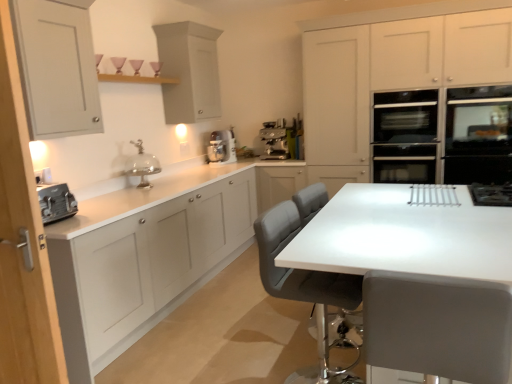
Question: Is gray leather chair at center, marked as the 1th chair in a back-to-front arrangement, wider than matte white toaster at left, which is the second cabinetry in left-to-right order?

Choices:
 (A) no
 (B) yes

Answer: (B)

Question: From the image's perspective, is gray leather chair at center, marked as the 1th chair in a back-to-front arrangement, above matte white toaster at left, placed as the 4th cabinetry when sorted from right to left?

Choices:
 (A) yes
 (B) no

Answer: (B)

Question: Could you tell me if gray leather chair at center, marked as the 1th chair in a back-to-front arrangement, is turned towards matte white toaster at left, placed as the 4th cabinetry when sorted from right to left?

Choices:
 (A) no
 (B) yes

Answer: (A)

Question: Is gray leather chair at center, marked as the 1th chair in a back-to-front arrangement, not near matte white toaster at left, placed as the 4th cabinetry when sorted from right to left?

Choices:
 (A) yes
 (B) no

Answer: (A)

Question: Does gray leather chair at center, positioned as the 2th chair in front-to-back order, lie behind matte white toaster at left, which is the second cabinetry in left-to-right order?

Choices:
 (A) no
 (B) yes

Answer: (B)

Question: From a real-world perspective, is satin silver espresso machine at center above or below white matte cabinet at left, positioned as the 3th cabinetry in left-to-right order?

Choices:
 (A) below
 (B) above

Answer: (B)

Question: Is satin silver espresso machine at center spatially inside white matte cabinet at left, the 3th cabinetry from the right, or outside of it?

Choices:
 (A) outside
 (B) inside

Answer: (A)

Question: Considering the positions of satin silver espresso machine at center and white matte cabinet at left, positioned as the 3th cabinetry in left-to-right order, in the image, is satin silver espresso machine at center bigger or smaller than white matte cabinet at left, positioned as the 3th cabinetry in left-to-right order,?

Choices:
 (A) big
 (B) small

Answer: (B)

Question: From the image's perspective, is satin silver espresso machine at center above or below white matte cabinet at left, positioned as the 3th cabinetry in left-to-right order?

Choices:
 (A) above
 (B) below

Answer: (A)

Question: Is point (11, 19) positioned closer to the camera than point (391, 236)?

Choices:
 (A) farther
 (B) closer

Answer: (B)

Question: Relative to white glossy table at center, is matte gray cabinet at upper left, the 1th cabinetry from the left, in front or behind?

Choices:
 (A) front
 (B) behind

Answer: (B)

Question: Is matte gray cabinet at upper left, the fifth cabinetry when ordered from right to left, bigger or smaller than white glossy table at center?

Choices:
 (A) big
 (B) small

Answer: (B)

Question: Is matte gray cabinet at upper left, the 1th cabinetry from the left, inside or outside of white glossy table at center?

Choices:
 (A) inside
 (B) outside

Answer: (B)

Question: From the image's perspective, is matte gray chair at center, arranged as the 1th chair when viewed from the front, above or below gray leather chair at center, positioned as the 2th chair in front-to-back order?

Choices:
 (A) above
 (B) below

Answer: (B)

Question: In terms of height, does matte gray chair at center, arranged as the 1th chair when viewed from the front, look taller or shorter compared to gray leather chair at center, positioned as the 2th chair in front-to-back order?

Choices:
 (A) tall
 (B) short

Answer: (B)